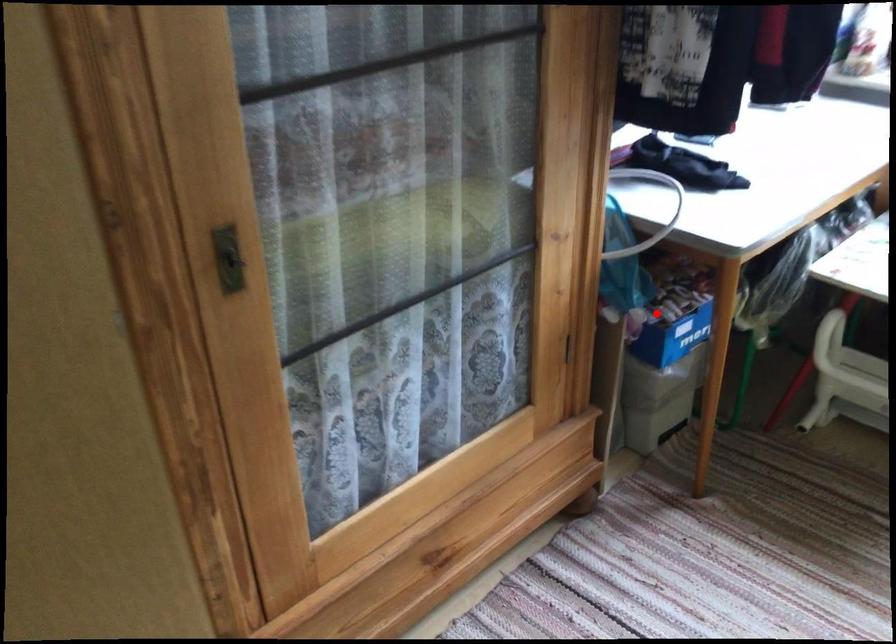
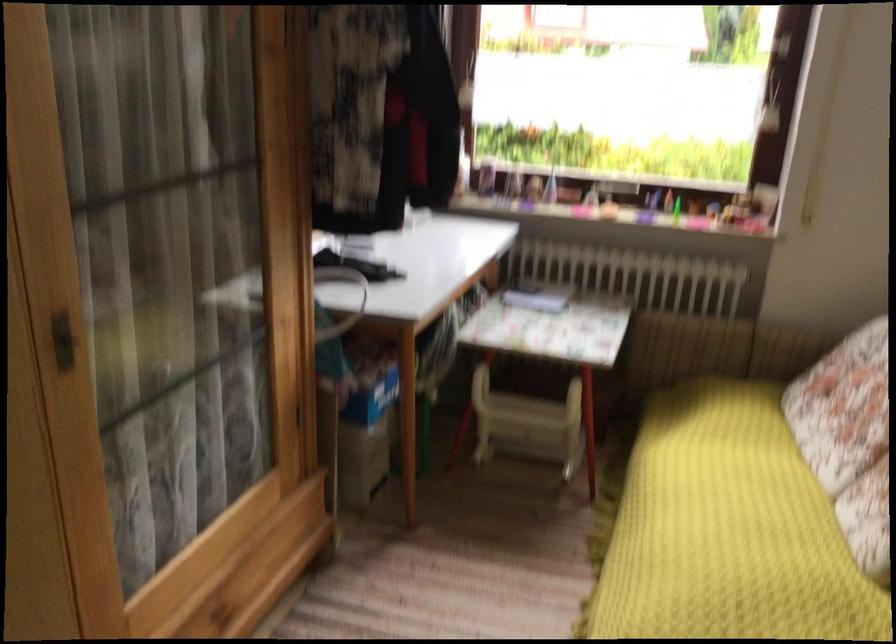
Question: I am providing you with two images of the same scene from different viewpoints. In image1, a red point is highlighted. Considering the same 3D point in image2, which of the following is correct?

Choices:
 (A) It is closer
 (B) It is farther

Answer: (B)